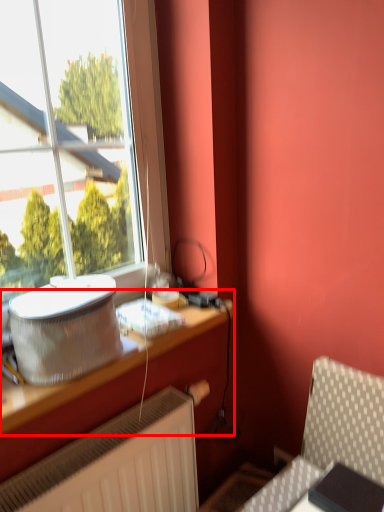
Question: From the image's perspective, where is table (annotated by the red box) located in relation to appliance in the image?

Choices:
 (A) above
 (B) below

Answer: (B)